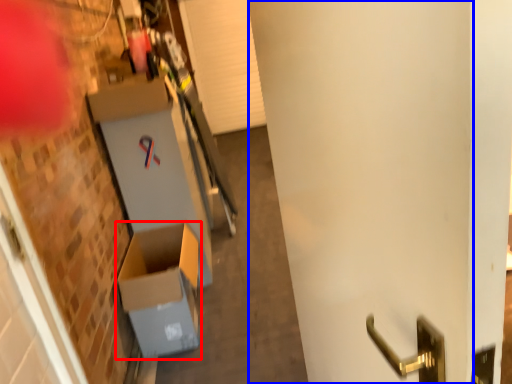
Question: Which of the following is the closest to the observer, cardboard box (highlighted by a red box) or door (highlighted by a blue box)?

Choices:
 (A) cardboard box
 (B) door

Answer: (B)